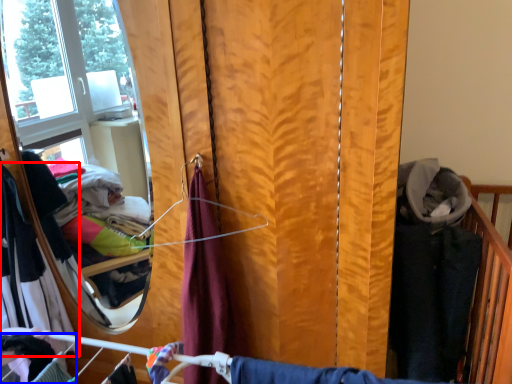
Question: Which object is closer to the camera taking this photo, clothing (highlighted by a red box) or clothing (highlighted by a blue box)?

Choices:
 (A) clothing
 (B) clothing

Answer: (B)